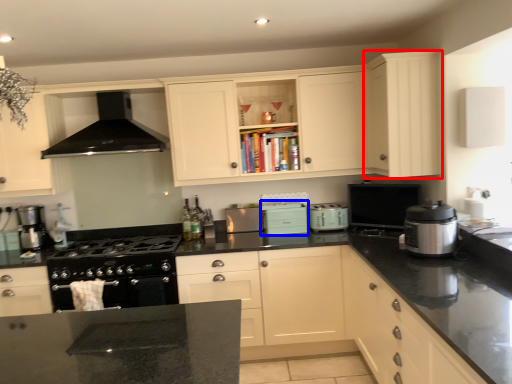
Question: Which of the following is the farthest to the observer, cabinetry (highlighted by a red box) or appliance (highlighted by a blue box)?

Choices:
 (A) cabinetry
 (B) appliance

Answer: (B)